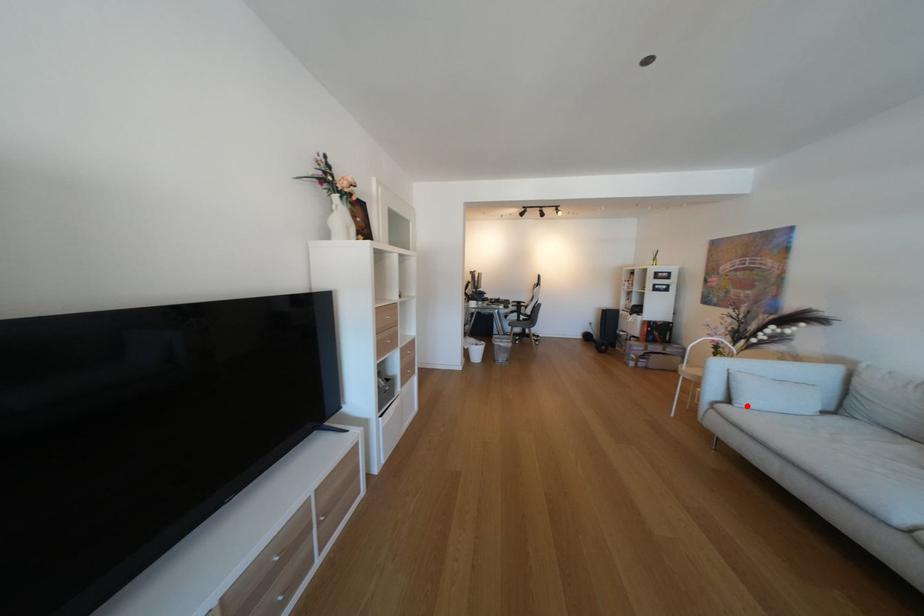
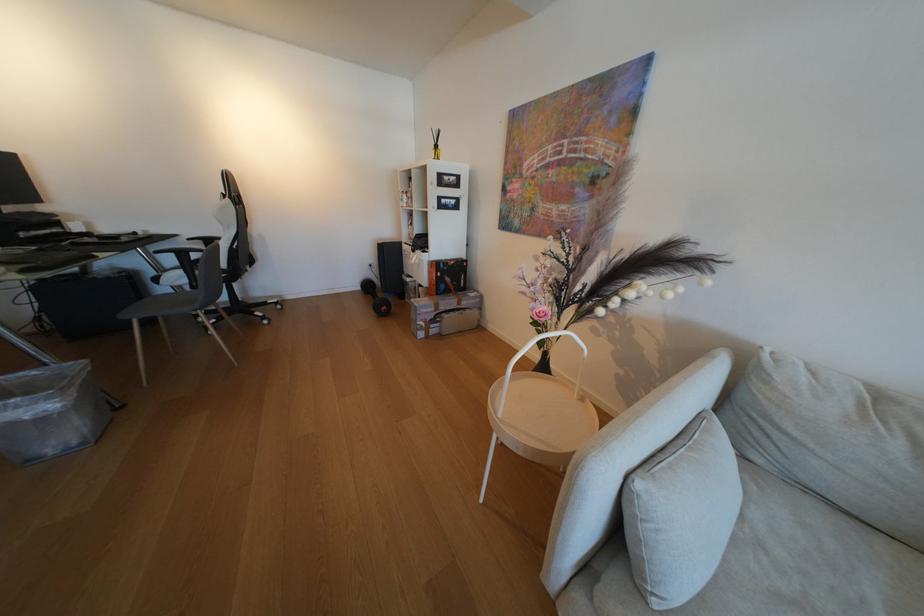
The point at the highlighted location is marked in the first image. Where is the corresponding point in the second image?

(665, 604)